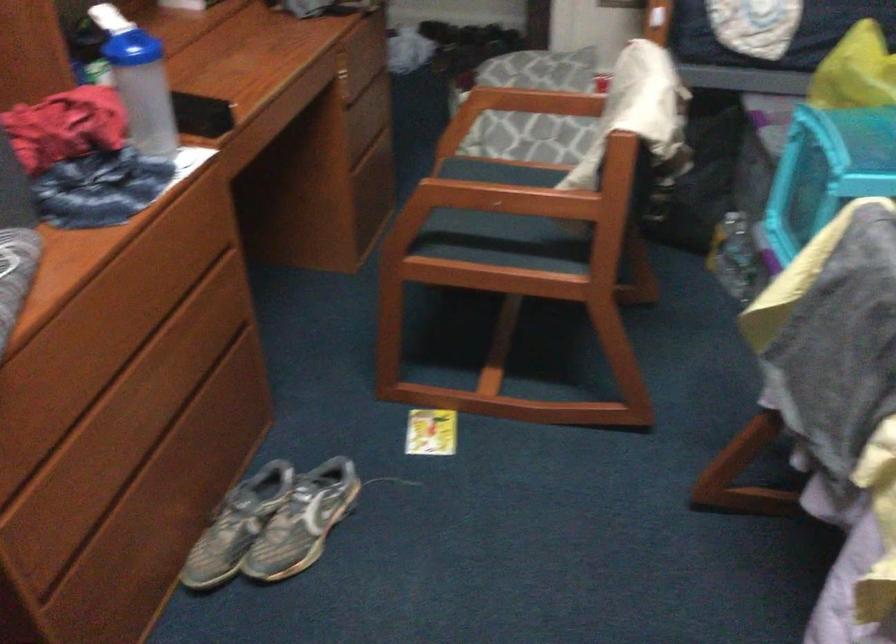
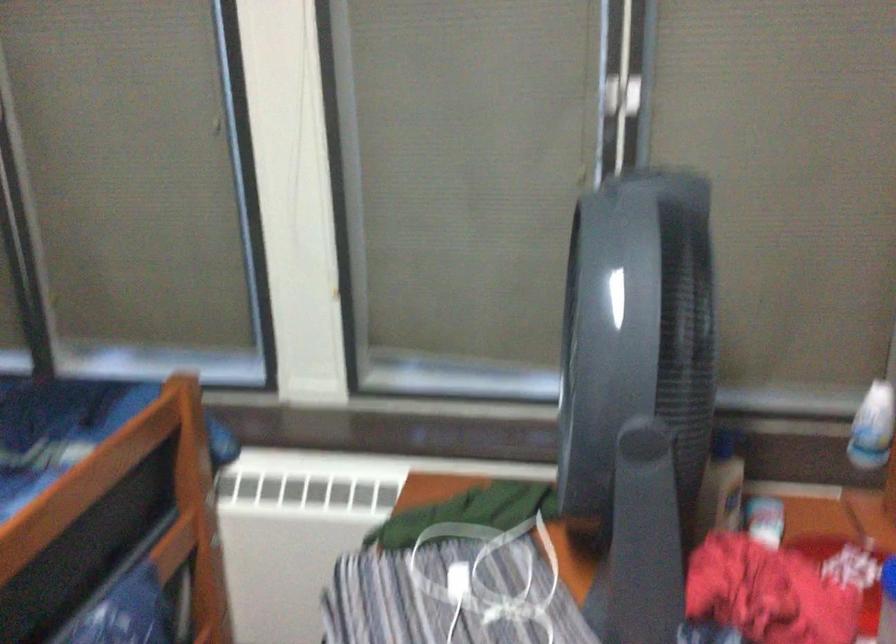
Question: The camera is either moving clockwise (left) or counter-clockwise (right) around the object. The first image is from the beginning of the video and the second image is from the end. Is the camera moving left or right when shooting the video?

Choices:
 (A) Left
 (B) Right

Answer: (B)